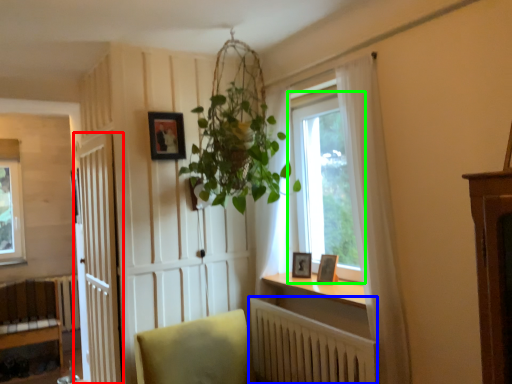
Question: Estimate the real-world distances between objects in this image. Which object is farther from door (highlighted by a red box), radiator (highlighted by a blue box) or window (highlighted by a green box)?

Choices:
 (A) radiator
 (B) window

Answer: (B)